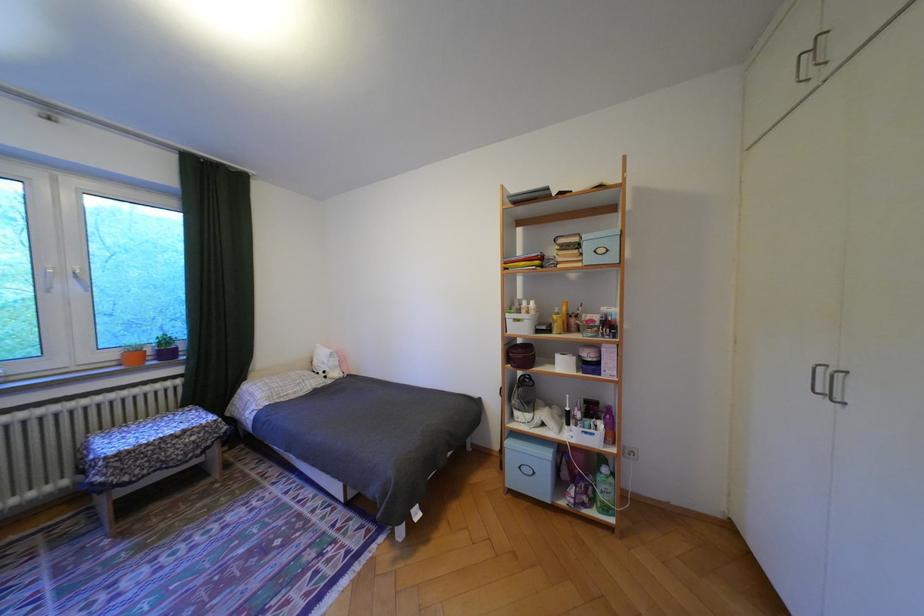
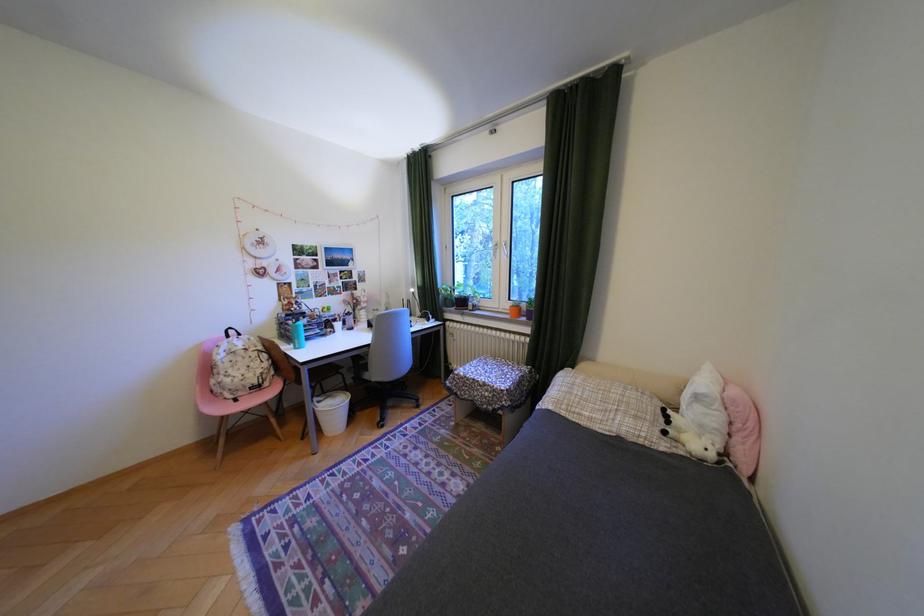
Where in the second image is the point corresponding to point (138, 477) from the first image?

(470, 392)